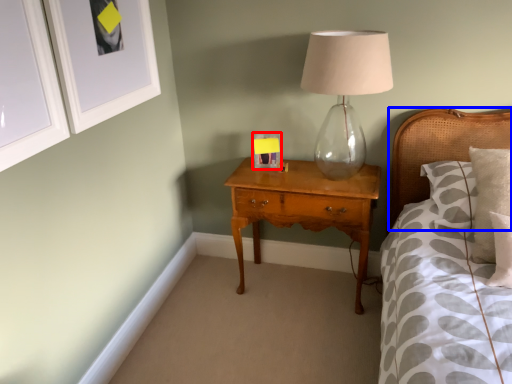
Question: Which point is further to the camera, picture frame (highlighted by a red box) or headboard (highlighted by a blue box)?

Choices:
 (A) picture frame
 (B) headboard

Answer: (A)